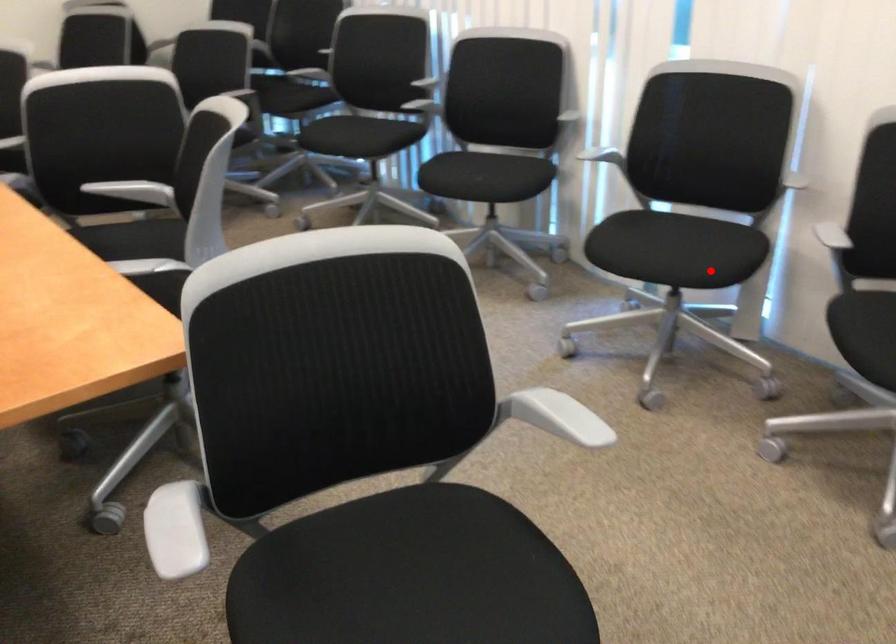
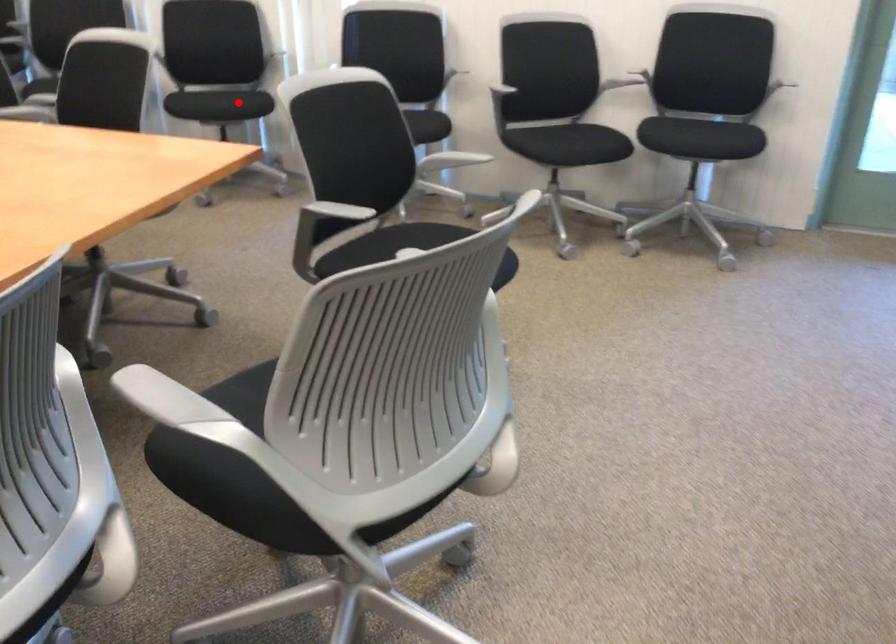
I am providing you with two images of the same scene from different viewpoints. A red point is marked on the first image and another point is marked on the second image. Are the points marked in image1 and image2 representing the same 3D position?

No